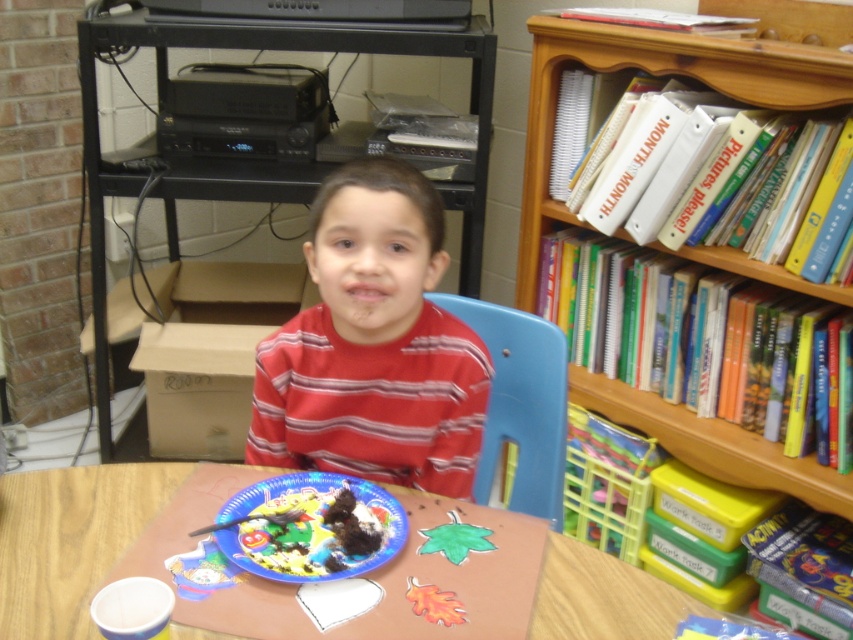
Question: Which object is closer to the camera taking this photo?

Choices:
 (A) brown paper table at center
 (B) blue plastic chair at center
 (C) wooden bookcase at upper right
 (D) wooden bookshelf at upper right

Answer: (A)

Question: Is wooden bookcase at upper right to the left of brown paper table at center from the viewer's perspective?

Choices:
 (A) no
 (B) yes

Answer: (A)

Question: Can you confirm if red striped shirt at center is wider than wooden bookshelf at upper right?

Choices:
 (A) yes
 (B) no

Answer: (B)

Question: Which point appears closest to the camera in this image?

Choices:
 (A) (305, 365)
 (B) (10, 516)

Answer: (B)

Question: Among these points, which one is nearest to the camera?

Choices:
 (A) (99, 308)
 (B) (370, 566)

Answer: (B)

Question: Is wooden bookcase at upper right above brown paper table at center?

Choices:
 (A) no
 (B) yes

Answer: (B)